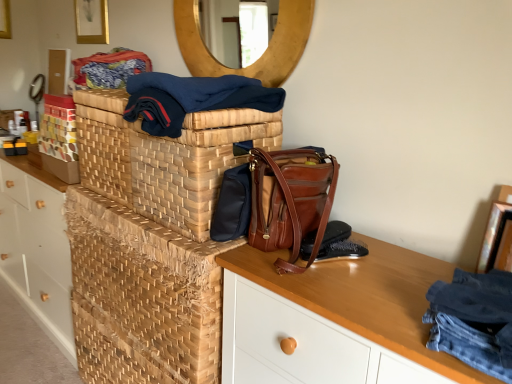
Identify the location of vacant area located to the right-hand side of black leather shoe at lower right, the second shoe in the bottom-to-top sequence. (391, 264).